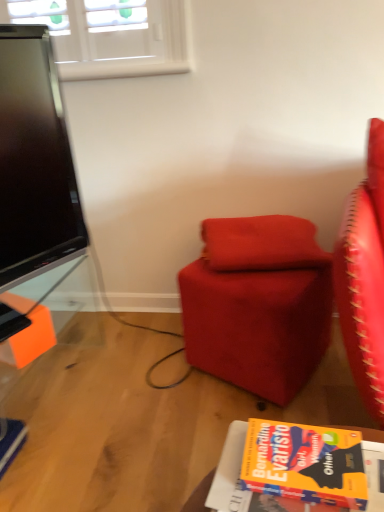
Question: Is suede-like red ottoman at center oriented towards velvet red pillow at center?

Choices:
 (A) no
 (B) yes

Answer: (A)

Question: Is the surface of suede-like red ottoman at center in direct contact with velvet red pillow at center?

Choices:
 (A) no
 (B) yes

Answer: (A)

Question: Is the position of suede-like red ottoman at center more distant than that of velvet red pillow at center?

Choices:
 (A) yes
 (B) no

Answer: (B)

Question: Can you confirm if suede-like red ottoman at center is wider than velvet red pillow at center?

Choices:
 (A) no
 (B) yes

Answer: (B)

Question: Does suede-like red ottoman at center have a larger size compared to velvet red pillow at center?

Choices:
 (A) yes
 (B) no

Answer: (A)

Question: Is point (309, 225) closer or farther from the camera than point (263, 228)?

Choices:
 (A) closer
 (B) farther

Answer: (B)

Question: Considering the positions of suede-like red ottoman at center and velvet red pillow at center in the image, is suede-like red ottoman at center bigger or smaller than velvet red pillow at center?

Choices:
 (A) big
 (B) small

Answer: (A)

Question: Do you think suede-like red ottoman at center is within velvet red pillow at center, or outside of it?

Choices:
 (A) outside
 (B) inside

Answer: (A)

Question: Is suede-like red ottoman at center wider or thinner than velvet red pillow at center?

Choices:
 (A) thin
 (B) wide

Answer: (B)

Question: Relative to orange matte book at lower right, is suede-like red ottoman at center in front or behind?

Choices:
 (A) behind
 (B) front

Answer: (A)

Question: In the image, is suede-like red ottoman at center on the left side or the right side of orange matte book at lower right?

Choices:
 (A) right
 (B) left

Answer: (A)

Question: Is suede-like red ottoman at center wider or thinner than orange matte book at lower right?

Choices:
 (A) thin
 (B) wide

Answer: (B)

Question: From a real-world perspective, relative to orange matte book at lower right, is suede-like red ottoman at center vertically above or below?

Choices:
 (A) below
 (B) above

Answer: (A)

Question: From the image's perspective, relative to suede-like red ottoman at center, is velvet red pillow at center above or below?

Choices:
 (A) above
 (B) below

Answer: (A)

Question: From their relative heights in the image, would you say velvet red pillow at center is taller or shorter than suede-like red ottoman at center?

Choices:
 (A) tall
 (B) short

Answer: (B)